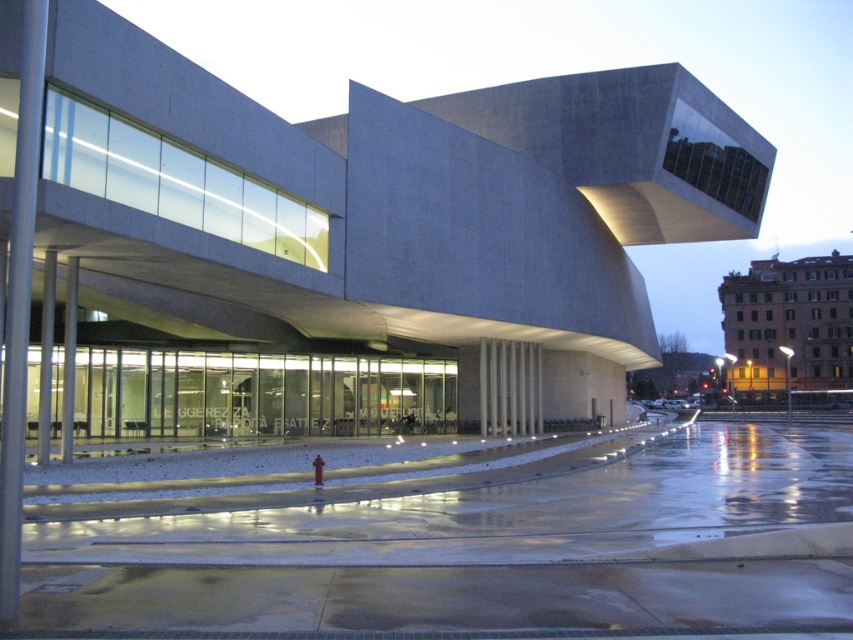
Question: Which of the following is the farthest from the observer?

Choices:
 (A) concrete building at center
 (B) yellow brick building at right
 (C) red matte hydrant at lower center

Answer: (B)

Question: Can you confirm if concrete building at center is bigger than yellow brick building at right?

Choices:
 (A) yes
 (B) no

Answer: (A)

Question: Can you confirm if yellow brick building at right is positioned above red matte hydrant at lower center?

Choices:
 (A) yes
 (B) no

Answer: (A)

Question: Which object appears closest to the camera in this image?

Choices:
 (A) concrete building at center
 (B) red matte hydrant at lower center
 (C) yellow brick building at right

Answer: (A)

Question: Is concrete building at center to the left of red matte hydrant at lower center from the viewer's perspective?

Choices:
 (A) no
 (B) yes

Answer: (A)

Question: Which point appears farthest from the camera in this image?

Choices:
 (A) (343, 246)
 (B) (315, 465)

Answer: (A)